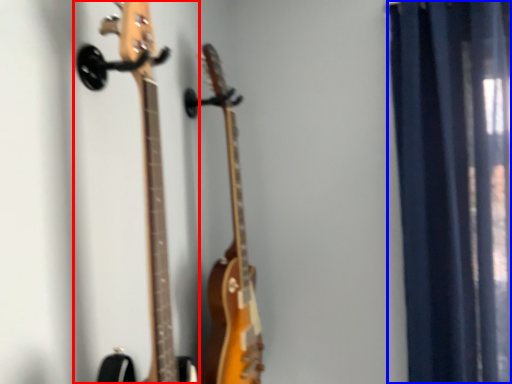
Question: Which object appears farthest to the camera in this image, guitar (highlighted by a red box) or curtain (highlighted by a blue box)?

Choices:
 (A) guitar
 (B) curtain

Answer: (B)